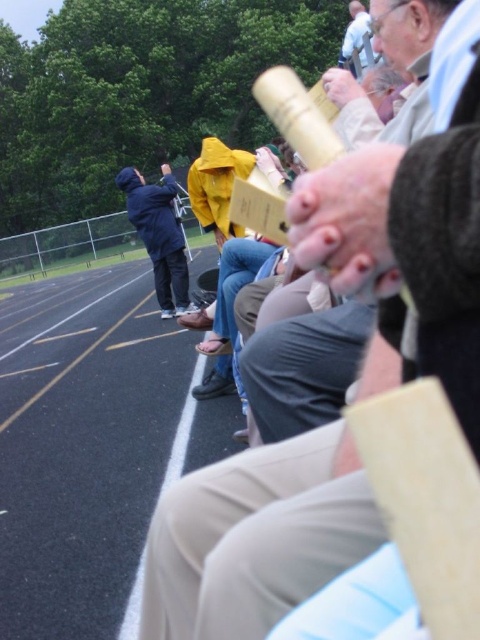
Question: Is wooden telescope at center positioned behind light blue shirt at upper center?

Choices:
 (A) yes
 (B) no

Answer: (B)

Question: Where is blue matte jacket at center located in relation to light blue shirt at upper center in the image?

Choices:
 (A) below
 (B) above

Answer: (A)

Question: Does wooden telescope at center have a greater width compared to light blue shirt at upper center?

Choices:
 (A) no
 (B) yes

Answer: (A)

Question: Which point appears farthest from the camera in this image?

Choices:
 (A) (457, 113)
 (B) (351, 35)
 (C) (188, 282)
 (D) (263, 429)

Answer: (B)

Question: Among these points, which one is nearest to the camera?

Choices:
 (A) (323, 408)
 (B) (274, 518)
 (C) (156, 259)
 (D) (360, 65)

Answer: (B)

Question: Which point appears farthest from the camera in this image?

Choices:
 (A) (175, 189)
 (B) (361, 42)
 (C) (331, 403)

Answer: (B)